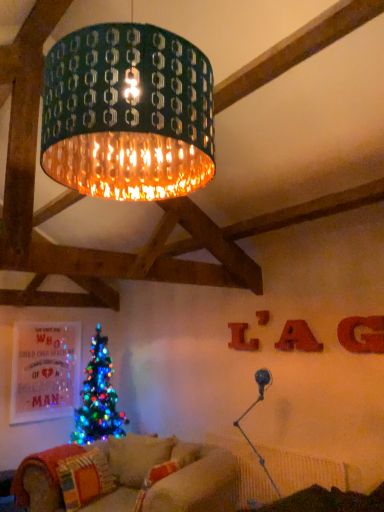
Question: Is multicolored fabric pillow at lower left, the 1th pillow when ordered from left to right, behind matte red letter at upper right, which is the fourth letter from right to left?

Choices:
 (A) no
 (B) yes

Answer: (A)

Question: Is multicolored fabric pillow at lower left, which appears as the 2th pillow when viewed from the right, closer to the viewer compared to matte red letter at upper right, the 4th letter in the front-to-back sequence?

Choices:
 (A) yes
 (B) no

Answer: (A)

Question: Can you see multicolored fabric pillow at lower left, which appears as the 2th pillow when viewed from the right, touching matte red letter at upper right, marked as the 1th letter in a back-to-front arrangement?

Choices:
 (A) yes
 (B) no

Answer: (B)

Question: Considering the relative sizes of multicolored fabric pillow at lower left, which appears as the 2th pillow when viewed from the right, and matte red letter at upper right, positioned as the 1th letter in left-to-right order, in the image provided, is multicolored fabric pillow at lower left, which appears as the 2th pillow when viewed from the right, shorter than matte red letter at upper right, positioned as the 1th letter in left-to-right order,?

Choices:
 (A) no
 (B) yes

Answer: (A)

Question: From a real-world perspective, is multicolored fabric pillow at lower left, the 1th pillow when ordered from left to right, below matte red letter at upper right, the 4th letter in the front-to-back sequence?

Choices:
 (A) yes
 (B) no

Answer: (A)

Question: Is metallic silver table lamp at lower right in front of or behind wooden letter at center right, positioned as the third letter in right-to-left order, in the image?

Choices:
 (A) behind
 (B) front

Answer: (B)

Question: Is metallic silver table lamp at lower right spatially inside wooden letter at center right, positioned as the third letter in right-to-left order, or outside of it?

Choices:
 (A) outside
 (B) inside

Answer: (A)

Question: Does point (256, 456) appear closer or farther from the camera than point (256, 312)?

Choices:
 (A) farther
 (B) closer

Answer: (B)

Question: Considering the positions of metallic silver table lamp at lower right and wooden letter at center right, positioned as the third letter in right-to-left order, in the image, is metallic silver table lamp at lower right bigger or smaller than wooden letter at center right, positioned as the third letter in right-to-left order,?

Choices:
 (A) big
 (B) small

Answer: (A)

Question: Considering the positions of wooden letter at center right, positioned as the third letter in right-to-left order, and red felt letter g at upper right, which appears as the fourth letter when viewed from the left, in the image, is wooden letter at center right, positioned as the third letter in right-to-left order, wider or thinner than red felt letter g at upper right, which appears as the fourth letter when viewed from the left,?

Choices:
 (A) thin
 (B) wide

Answer: (A)

Question: Would you say wooden letter at center right, marked as the second letter in a back-to-front arrangement, is inside or outside red felt letter g at upper right, which appears as the first letter when viewed from the front?

Choices:
 (A) outside
 (B) inside

Answer: (A)

Question: From a real-world perspective, relative to red felt letter g at upper right, positioned as the fourth letter in back-to-front order, is wooden letter at center right, the third letter in the front-to-back sequence, vertically above or below?

Choices:
 (A) below
 (B) above

Answer: (B)

Question: Looking at the image, does wooden letter at center right, marked as the second letter in a back-to-front arrangement, seem bigger or smaller compared to red felt letter g at upper right, positioned as the fourth letter in back-to-front order?

Choices:
 (A) small
 (B) big

Answer: (A)

Question: Considering the positions of red felt letter g at upper right, which appears as the first letter when viewed from the front, and matte red letter at upper right, which is the fourth letter from right to left, in the image, is red felt letter g at upper right, which appears as the first letter when viewed from the front, wider or thinner than matte red letter at upper right, which is the fourth letter from right to left,?

Choices:
 (A) thin
 (B) wide

Answer: (B)

Question: In the image, is red felt letter g at upper right, positioned as the fourth letter in back-to-front order, positioned in front of or behind matte red letter at upper right, positioned as the 1th letter in left-to-right order?

Choices:
 (A) front
 (B) behind

Answer: (A)